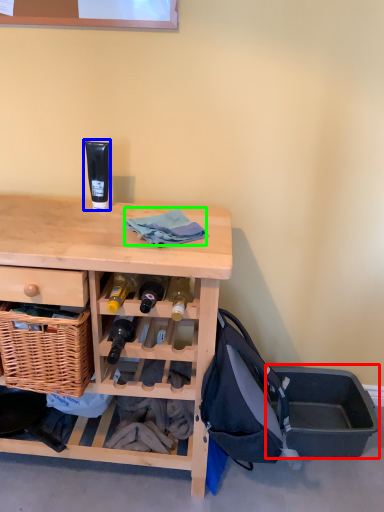
Question: Which is farther away from storage box (highlighted by a red box)? toiletry (highlighted by a blue box) or clothing (highlighted by a green box)?

Choices:
 (A) toiletry
 (B) clothing

Answer: (A)